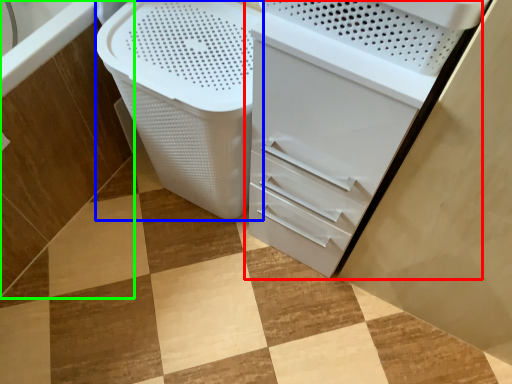
Question: Which object is the closest to the file cabinet (highlighted by a red box)? Choose among these: laundry basket (highlighted by a blue box) or bath (highlighted by a green box).

Choices:
 (A) laundry basket
 (B) bath

Answer: (A)